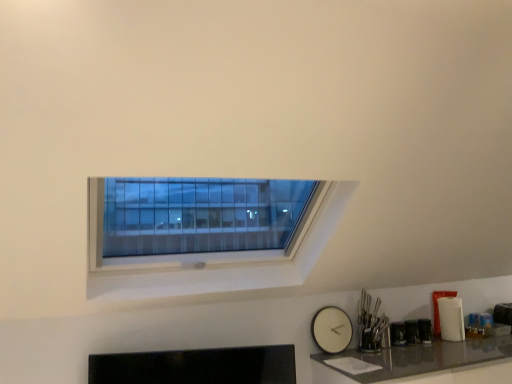
Question: From the image's perspective, would you say white matte clock at lower right is shown under shiny gray countertop at lower right?

Choices:
 (A) yes
 (B) no

Answer: (B)

Question: Is white matte clock at lower right oriented away from shiny gray countertop at lower right?

Choices:
 (A) yes
 (B) no

Answer: (B)

Question: Is the depth of white matte clock at lower right greater than that of shiny gray countertop at lower right?

Choices:
 (A) no
 (B) yes

Answer: (B)

Question: Does white matte clock at lower right contain shiny gray countertop at lower right?

Choices:
 (A) yes
 (B) no

Answer: (B)

Question: Does white matte clock at lower right appear on the left side of shiny gray countertop at lower right?

Choices:
 (A) no
 (B) yes

Answer: (B)

Question: Is white matte clock at lower right not close to shiny gray countertop at lower right?

Choices:
 (A) yes
 (B) no

Answer: (B)

Question: Is shiny gray countertop at lower right closer to the viewer compared to white matte clock at lower right?

Choices:
 (A) no
 (B) yes

Answer: (B)

Question: Does shiny gray countertop at lower right have a larger size compared to white matte clock at lower right?

Choices:
 (A) no
 (B) yes

Answer: (B)

Question: Can you confirm if shiny gray countertop at lower right is smaller than white matte clock at lower right?

Choices:
 (A) yes
 (B) no

Answer: (B)

Question: Is shiny gray countertop at lower right looking in the opposite direction of white matte clock at lower right?

Choices:
 (A) no
 (B) yes

Answer: (A)

Question: Could you tell me if shiny gray countertop at lower right is facing white matte clock at lower right?

Choices:
 (A) no
 (B) yes

Answer: (A)

Question: From the image's perspective, is shiny gray countertop at lower right located beneath white matte clock at lower right?

Choices:
 (A) no
 (B) yes

Answer: (B)

Question: Is shiny gray countertop at lower right wider or thinner than white matte clock at lower right?

Choices:
 (A) thin
 (B) wide

Answer: (B)